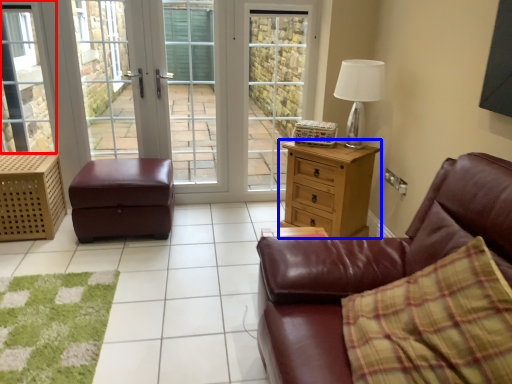
Question: Which point is closer to the camera, window (highlighted by a red box) or chest of drawers (highlighted by a blue box)?

Choices:
 (A) window
 (B) chest of drawers

Answer: (B)